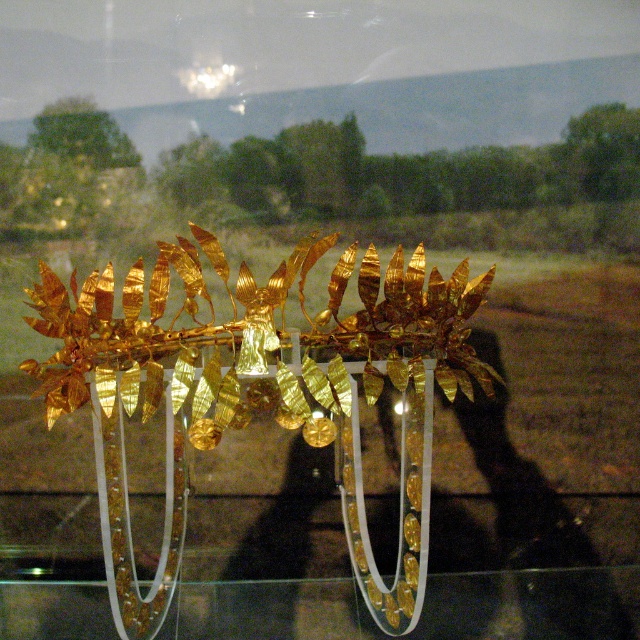
You are a museum visitor standing in front of the glass case containing the crown. You notice a point marked at coordinates (x=253, y=332). Can you identify what object this point is pointing to?

The point at coordinates (x=253, y=332) corresponds to the gold leafy tiara at center, as stated in the object description.

You are a museum curator planning to install a protective shield over the gold leafy tiara at center and the transparent glass table at center. The shield must cover both objects completely. Based on their positions, can the shield be placed in a way that covers both without needing to adjust their current positions?

The gold leafy tiara at center is positioned over the transparent glass table at center, so the shield can be placed over both objects without needing to adjust their positions since the tiara is already above the table, allowing the shield to cover both simultaneously.

You are a museum curator arranging an exhibition. You need to place a decorative vase on the transparent glass table at center so that it does not block the view of the gold leafy tiara at center. Where should you place the vase?

The gold leafy tiara at center is on the left side of the transparent glass table at center, so placing the vase on the right side of the transparent glass table at center will keep it from blocking the view of the tiara.